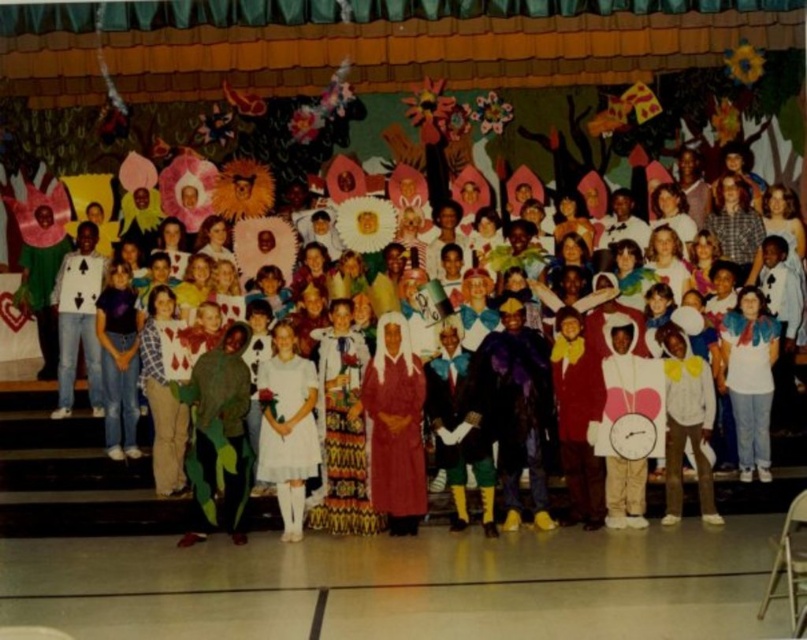
Question: Which point is farther to the camera?

Choices:
 (A) white cotton dress at center
 (B) white satin dress at center

Answer: (A)

Question: Is white cotton dress at center wider than white satin dress at center?

Choices:
 (A) no
 (B) yes

Answer: (B)

Question: Is white cotton dress at center to the left of white satin dress at center from the viewer's perspective?

Choices:
 (A) yes
 (B) no

Answer: (B)

Question: Is white cotton dress at center closer to camera compared to white satin dress at center?

Choices:
 (A) yes
 (B) no

Answer: (B)